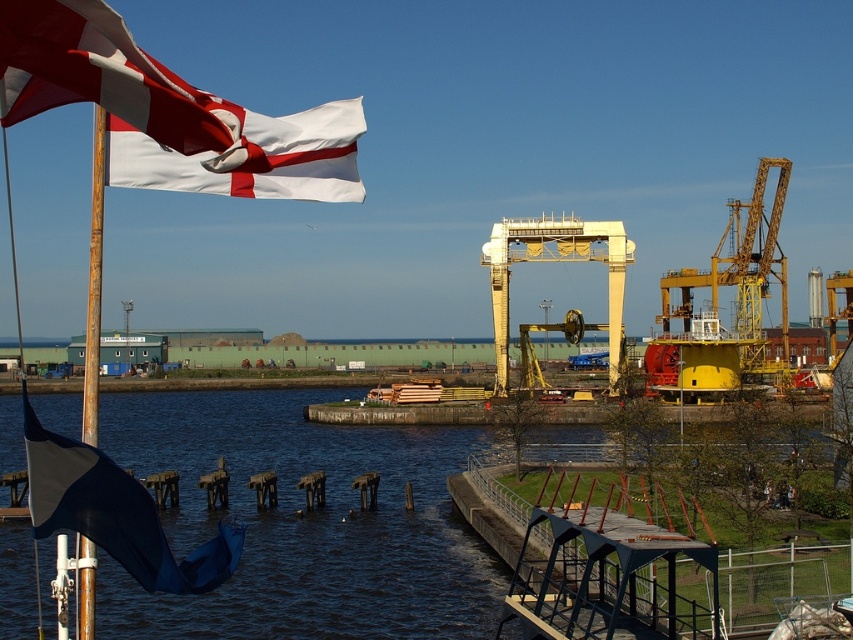
You are a photographer planning to take a photo of the waterfront scene. You want to ensure that the dark blue water at center and the blue fabric flag at left are both visible in the frame. Based on their widths, which object should you position closer to the edge of the photo to avoid overcrowding the composition?

Since the dark blue water at center is wider than the blue fabric flag at left, you should position the wider dark blue water at center closer to the edge to prevent it from dominating the composition and overcrowding the photo.

You are standing at the waterfront and want to determine which of the two points, point (207, 141) or point (769, 243), is nearer to you. Based on the scene, which point is closer?

Point (207, 141) is closer to the viewer than point (769, 243).

You are standing on the dock and want to know which object is taller between the dark blue water at center and the blue fabric flag at left. Can you determine which one is taller?

The blue fabric flag at left is taller than the dark blue water at center according to the description provided.